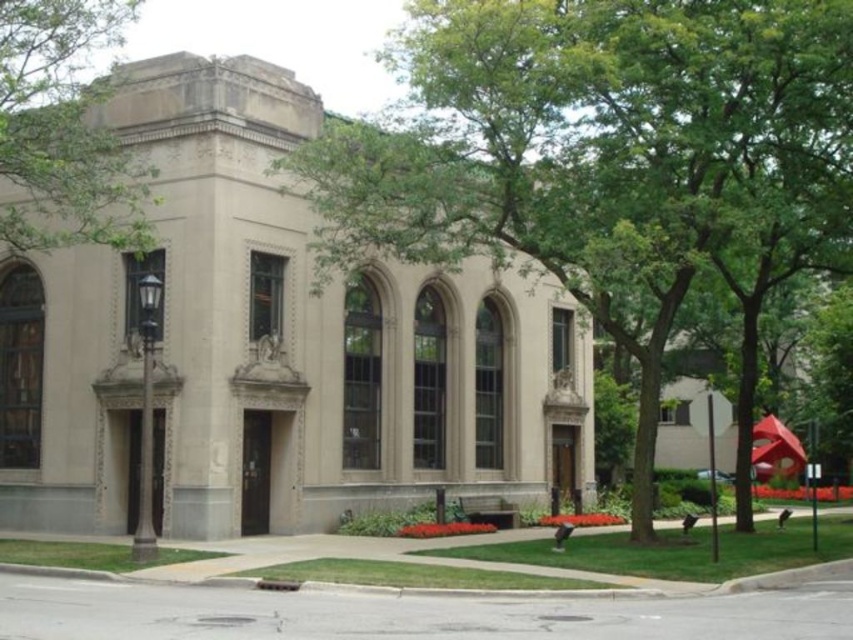
Can you confirm if green leafy tree at center is taller than green leafy tree at upper center?

Correct, green leafy tree at center is much taller as green leafy tree at upper center.

Is green leafy tree at center closer to camera compared to green leafy tree at upper center?

Yes, it is.

From the picture: Who is more distant from viewer, [741,449] or [47,204]?

Positioned behind is point [741,449].

This screenshot has width=853, height=640. In order to click on green leafy tree at center in this screenshot , I will do `click(602, 154)`.